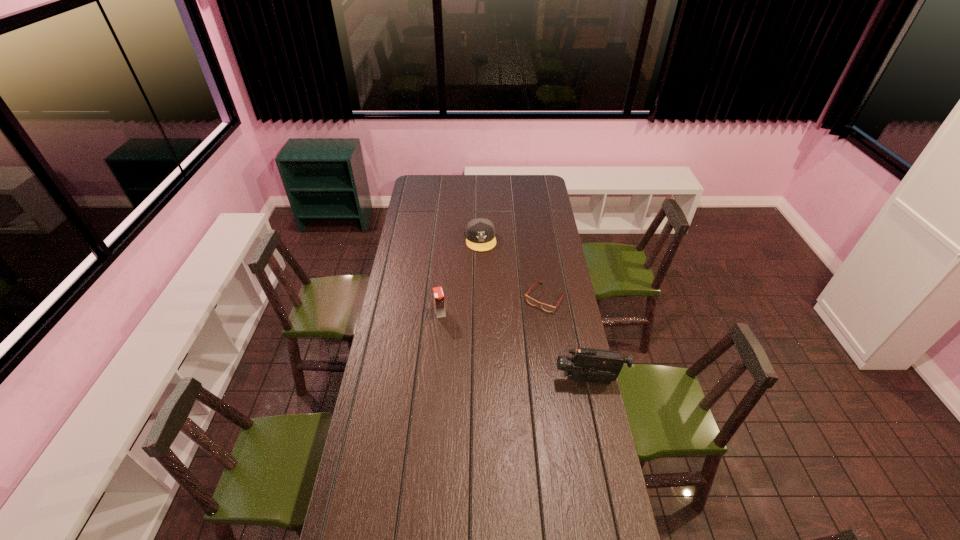
Locate an element on the screen. This screenshot has width=960, height=540. free spot on the desktop that is between the orange juice and the tallest object and is positioned on the front-facing side of the cap is located at coordinates (495, 338).

I want to click on free space on the desktop that is between the orange juice and the tallest object and is positioned on the front-facing side of the shortest object, so click(512, 345).